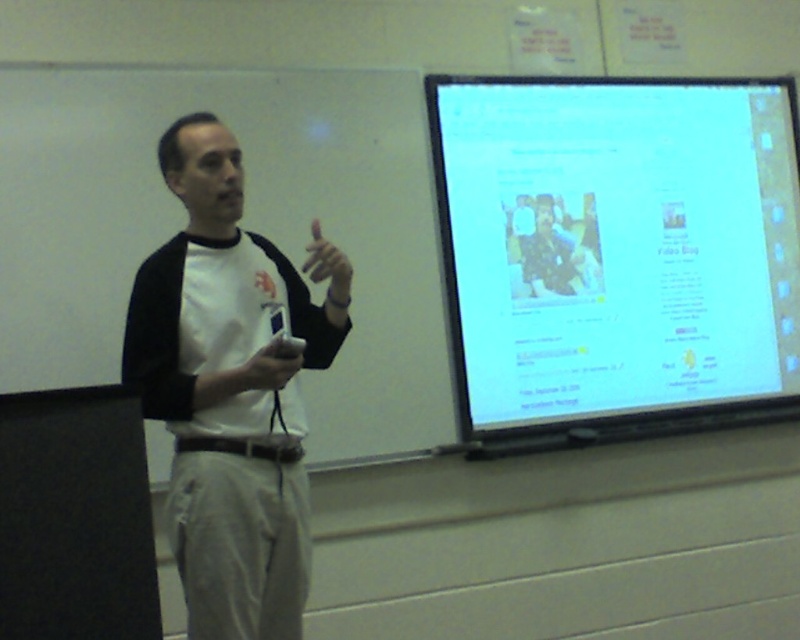
Is white matte shirt at center further to the viewer compared to white matte game controller at center?

No, white matte shirt at center is in front of white matte game controller at center.

Is white matte shirt at center smaller than white matte game controller at center?

No.

Who is more distant from viewer, (232,387) or (274,312)?

The point (274,312) is more distant.

The height and width of the screenshot is (640, 800). Identify the location of white matte shirt at center. (229, 390).

Does point (156, 330) come behind point (248, 365)?

That is True.

Who is positioned more to the right, white matte shirt at center or matte white remote at center?

Positioned to the right is matte white remote at center.

Where is `white matte shirt at center`? white matte shirt at center is located at coordinates (229, 390).

Image resolution: width=800 pixels, height=640 pixels. Identify the location of white matte shirt at center. (229, 390).

Does point (462, 125) come behind point (282, 353)?

Yes, point (462, 125) is farther from viewer.

Does white glossy screen at upper right have a smaller size compared to white matte game controller at center?

No.

Which is behind, point (514, 387) or point (274, 355)?

The point (514, 387) is more distant.

The width and height of the screenshot is (800, 640). In order to click on white glossy screen at upper right in this screenshot , I will do pos(616,248).